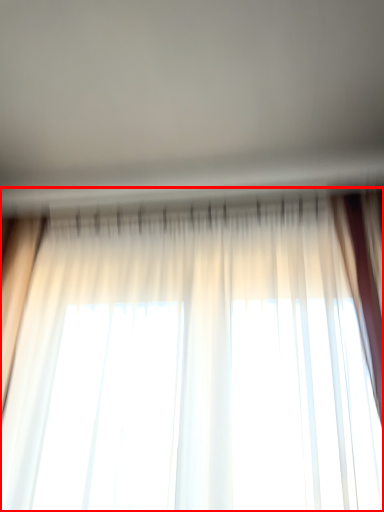
Question: Considering the relative positions of curtain (annotated by the red box) and backdrop in the image provided, where is curtain (annotated by the red box) located with respect to the staircase?

Choices:
 (A) right
 (B) left

Answer: (A)